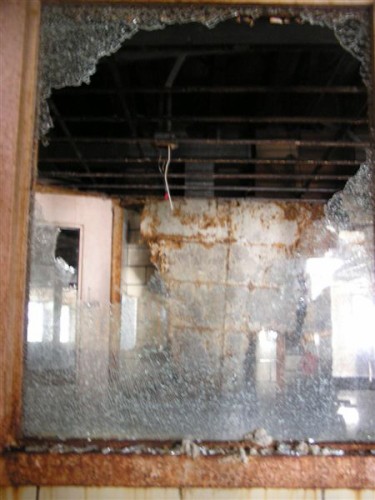
What are the coordinates of `window trim brown` in the screenshot? It's located at (6, 329), (8, 429), (15, 461), (200, 467), (351, 472), (6, 251), (25, 79), (24, 13).